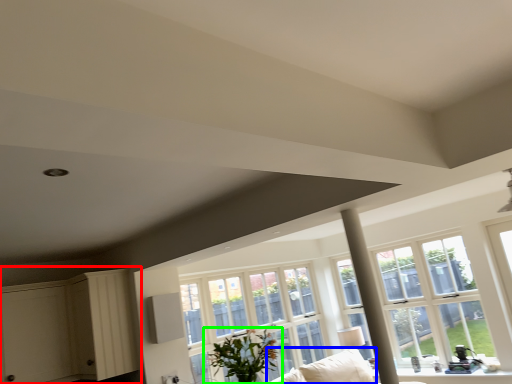
Question: Which is nearer to the dresser (highlighted by a red box)? couch (highlighted by a blue box) or houseplant (highlighted by a green box).

Choices:
 (A) couch
 (B) houseplant

Answer: (B)